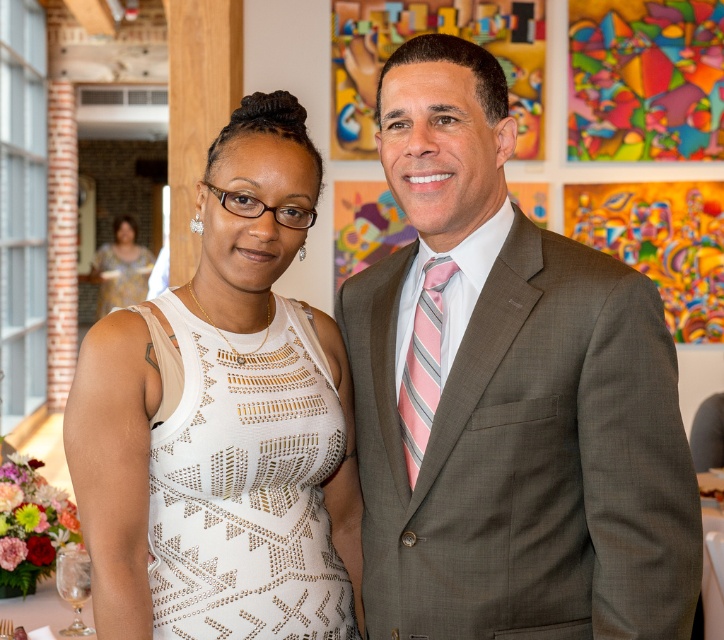
Based on the photo, you are a photographer at a formal event. You need to adjust the lighting to ensure both the gray suit at center and the pink striped tie at center are well illuminated. Considering their sizes, which one might require more focused lighting adjustments?

The gray suit at center has a larger size compared to the pink striped tie at center, so it might require more focused lighting adjustments to ensure proper illumination.

You are a photographer adjusting your camera settings to focus on two specific points in the image. The first point is at coordinates point (408, 424) and the second is at point (114, 257). Which point should you focus on first if you want to ensure the closest object is in sharp focus?

Point (408, 424) is closer to the camera than point (114, 257), so you should focus on point (408, 424) first to ensure the closest object is in sharp focus.

You are a photographer trying to capture a closeup shot of the white textured dress at center and the pink striped tie at center. Since you want to focus on the details of both, which object should you adjust your camera focus on first considering their sizes?

The white textured dress at center is taller than the pink striped tie at center, so you should focus on the white textured dress at center first as it occupies more space in the frame.